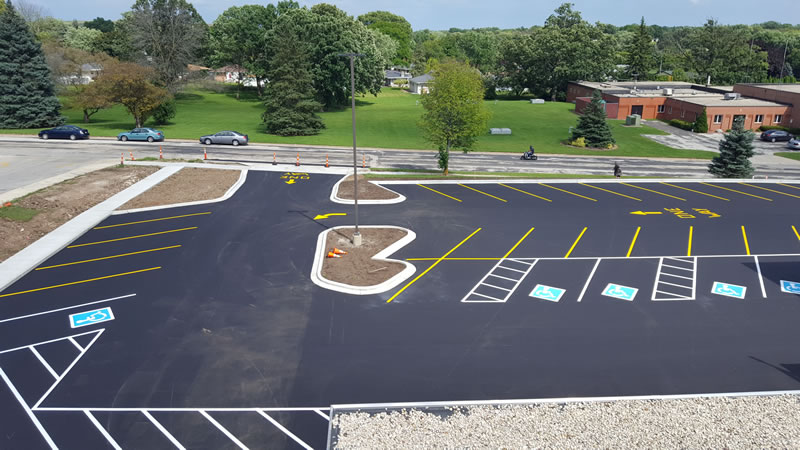
Find the location of a particular element. The image size is (800, 450). windows is located at coordinates (758, 121), (774, 117), (716, 117), (657, 109), (684, 114), (668, 112), (698, 119).